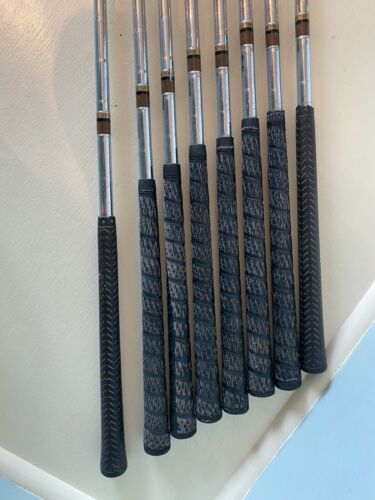
Locate an element on the screen. table is located at coordinates (42, 400).